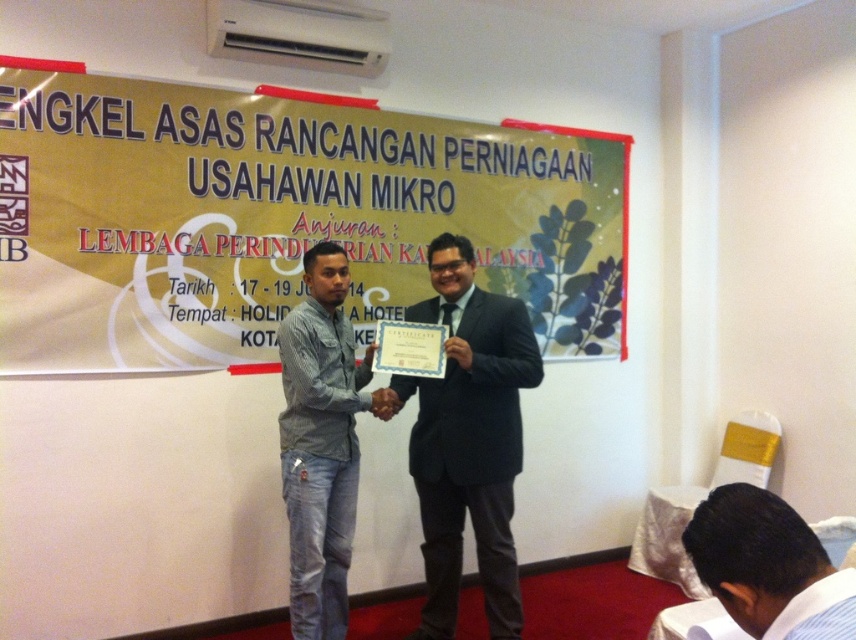
Question: Does yellow paperboard at upper center appear over dark blue suit at center?

Choices:
 (A) yes
 (B) no

Answer: (A)

Question: Based on their relative distances, which object is farther from the blue denim jeans at lower left?

Choices:
 (A) dark blue suit at center
 (B) white shirt at lower right

Answer: (B)

Question: Is dark blue suit at center positioned at the back of blue denim jeans at lower left?

Choices:
 (A) no
 (B) yes

Answer: (B)

Question: Which point appears closest to the camera in this image?

Choices:
 (A) (312, 273)
 (B) (370, 268)

Answer: (A)

Question: Does dark blue suit at center have a smaller size compared to blue denim jeans at lower left?

Choices:
 (A) yes
 (B) no

Answer: (B)

Question: Which object is closer to the camera taking this photo?

Choices:
 (A) white shirt at lower right
 (B) blue denim jeans at lower left
 (C) dark blue suit at center
 (D) yellow paperboard at upper center

Answer: (A)